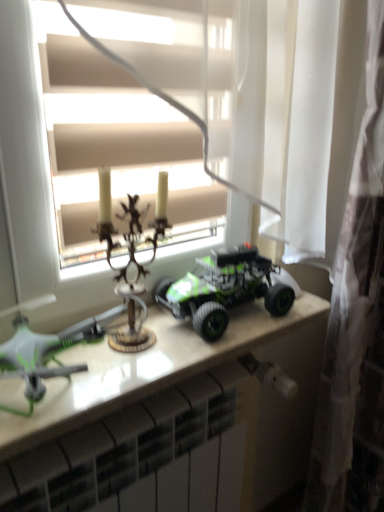
Find the location of a particular element. This screenshot has width=384, height=512. vacant area situated below green matte drone at left, which ranks as the third toy in right-to-left order (from a real-world perspective) is located at coordinates (67, 394).